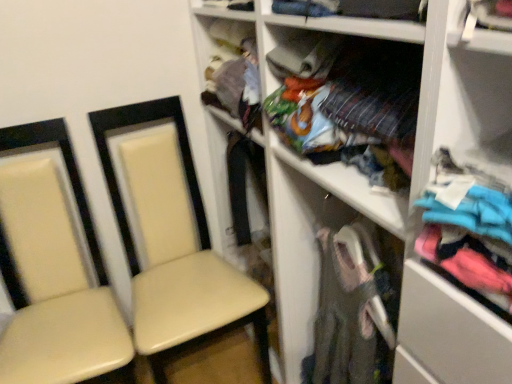
Question: Could you tell me if beige leather chair at left, which is the second chair from left to right, is facing matte white shelf at center?

Choices:
 (A) yes
 (B) no

Answer: (B)

Question: From a real-world perspective, is beige leather chair at left, placed as the first chair when sorted from right to left, physically above matte white shelf at center?

Choices:
 (A) no
 (B) yes

Answer: (A)

Question: Is beige leather chair at left, which is the second chair from left to right, far away from matte white shelf at center?

Choices:
 (A) no
 (B) yes

Answer: (A)

Question: Is beige leather chair at left, which is the second chair from left to right, not within matte white shelf at center?

Choices:
 (A) yes
 (B) no

Answer: (A)

Question: From the image's perspective, does beige leather chair at left, placed as the first chair when sorted from right to left, appear higher than matte white shelf at center?

Choices:
 (A) yes
 (B) no

Answer: (B)

Question: Does beige leather chair at left, placed as the first chair when sorted from right to left, have a lesser height compared to matte white shelf at center?

Choices:
 (A) yes
 (B) no

Answer: (A)

Question: Is multicolored fabric at center, acting as the 1th clothing starting from the back, positioned beyond the bounds of beige leather chair at left, which is the second chair from left to right?

Choices:
 (A) no
 (B) yes

Answer: (B)

Question: Is multicolored fabric at center, acting as the 1th clothing starting from the back, bigger than beige leather chair at left, placed as the first chair when sorted from right to left?

Choices:
 (A) yes
 (B) no

Answer: (B)

Question: From a real-world perspective, is multicolored fabric at center, acting as the 1th clothing starting from the back, below beige leather chair at left, placed as the first chair when sorted from right to left?

Choices:
 (A) no
 (B) yes

Answer: (A)

Question: Is multicolored fabric at center, acting as the 1th clothing starting from the back, facing towards beige leather chair at left, which is the second chair from left to right?

Choices:
 (A) no
 (B) yes

Answer: (A)

Question: Does multicolored fabric at center, acting as the 2th clothing starting from the front, have a smaller size compared to beige leather chair at left, placed as the first chair when sorted from right to left?

Choices:
 (A) no
 (B) yes

Answer: (B)

Question: Is multicolored fabric at center, acting as the 2th clothing starting from the front, far away from beige leather chair at left, which is the second chair from left to right?

Choices:
 (A) no
 (B) yes

Answer: (A)

Question: Is beige leather chair at left, which is the second chair from left to right, touching turquoise fabric shirt at right, the first clothing positioned from the front?

Choices:
 (A) yes
 (B) no

Answer: (B)